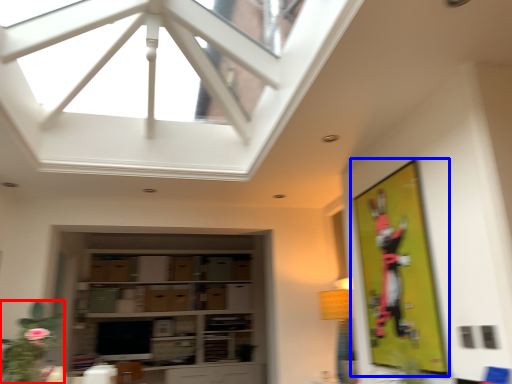
Question: Which object appears closest to the camera in this image, plant (highlighted by a red box) or bulletin board (highlighted by a blue box)?

Choices:
 (A) plant
 (B) bulletin board

Answer: (A)